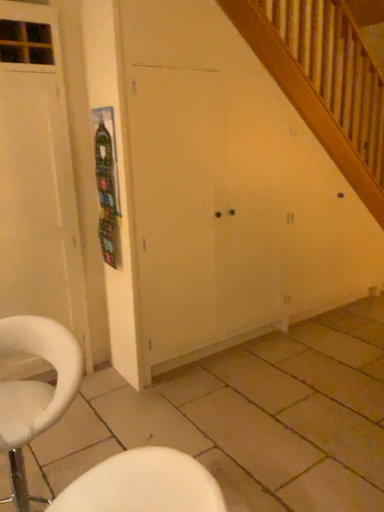
Where is `white fabric chair at lower left`? white fabric chair at lower left is located at coordinates (35, 392).

At what (x,y) coordinates should I click in order to perform the action: click on white matte cabinet at center. Please return your answer as a coordinate pair (x, y). Looking at the image, I should click on (192, 222).

From the image's perspective, is white matte cabinet at center positioned above or below metallic silver poster at upper left?

From the image's perspective, white matte cabinet at center appears below metallic silver poster at upper left.

Does white matte cabinet at center appear on the left side of metallic silver poster at upper left?

No, white matte cabinet at center is not to the left of metallic silver poster at upper left.

In the scene shown: Can metallic silver poster at upper left be found inside white matte cabinet at center?

Definitely not — metallic silver poster at upper left is not inside white matte cabinet at center.

Which of these two, white matte cabinet at center or white fabric chair at lower left, is thinner?

white fabric chair at lower left.

Locate an element on the screen. This screenshot has width=384, height=512. chair below the white matte cabinet at center (from the image's perspective) is located at coordinates (35, 392).

From the picture: Is white matte cabinet at center oriented towards white fabric chair at lower left?

No, white matte cabinet at center is not aimed at white fabric chair at lower left.

From the image's perspective, is white matte cabinet at center located beneath white fabric chair at lower left?

No, from the image's perspective, white matte cabinet at center is not beneath white fabric chair at lower left.

Is point (21, 370) behind point (354, 339)?

That is False.

Does white wood door at left contain beige tile at lower center?

No.

Looking at this image, from the image's perspective, is white wood door at left positioned above or below beige tile at lower center?

Based on their image positions, white wood door at left is located above beige tile at lower center.

From a real-world perspective, is metallic silver poster at upper left located higher than white matte cabinet at center?

Yes.

From the image's perspective, which one is positioned higher, metallic silver poster at upper left or white matte cabinet at center?

metallic silver poster at upper left, from the image's perspective.

Is metallic silver poster at upper left facing towards white matte cabinet at center?

No, metallic silver poster at upper left is not turned towards white matte cabinet at center.

Is there a large distance between metallic silver poster at upper left and white matte cabinet at center?

Actually, metallic silver poster at upper left and white matte cabinet at center are a little close together.

From a real-world perspective, is beige tile at lower center positioned above or below white matte cabinet at center?

Clearly, from a real-world perspective, beige tile at lower center is below white matte cabinet at center.

Looking at the image, does beige tile at lower center seem bigger or smaller compared to white matte cabinet at center?

Considering their sizes, beige tile at lower center takes up less space than white matte cabinet at center.

Consider the image. Which is correct: beige tile at lower center is inside white matte cabinet at center, or outside of it?

beige tile at lower center is outside white matte cabinet at center.

Is beige tile at lower center far from white matte cabinet at center?

No, there isn't a large distance between beige tile at lower center and white matte cabinet at center.

Is white matte cabinet at center further to camera compared to beige tile at lower center?

Yes, it is.

Which is in front, point (206, 322) or point (239, 460)?

The point (239, 460) is closer to the camera.

What's the angular difference between white matte cabinet at center and beige tile at lower center's facing directions?

They differ by 89.5 degrees in their facing directions.

From a real-world perspective, is metallic silver poster at upper left physically located above or below white wood door at left?

From a real-world perspective, metallic silver poster at upper left is physically above white wood door at left.

Who is more distant, metallic silver poster at upper left or white wood door at left?

metallic silver poster at upper left is further from the camera.

Find the location of `bulletin board behind the white wood door at left`. bulletin board behind the white wood door at left is located at coordinates (106, 182).

Where is `bulletin board behind the white matte cabinet at center`? bulletin board behind the white matte cabinet at center is located at coordinates (106, 182).

You are a GUI agent. You are given a task and a screenshot of the screen. Output one action in this format:
    pyautogui.click(x=<x>, y=<y>)
    Task: Click on the chair located underneath the white matte cabinet at center (from a real-world perspective)
    This screenshot has width=384, height=512.
    Given the screenshot: What is the action you would take?
    pyautogui.click(x=35, y=392)

Looking at the image, which one is located further to beige tile at lower center, white matte cabinet at center or white wood door at left?

white wood door at left is further to beige tile at lower center.

From the image, which object appears to be nearer to metallic silver poster at upper left, white wood door at left or white fabric chair at lower left?

white wood door at left is closer to metallic silver poster at upper left.

Looking at the image, which one is located further to white matte cabinet at center, metallic silver poster at upper left or beige tile at lower center?

The object further to white matte cabinet at center is beige tile at lower center.

Which object lies further to the anchor point metallic silver poster at upper left, beige tile at lower center or white matte cabinet at center?

beige tile at lower center is further to metallic silver poster at upper left.

Considering their positions, is white matte cabinet at center positioned closer to white wood door at left than beige tile at lower center?

Among the two, white matte cabinet at center is located nearer to white wood door at left.

Which object lies further to the anchor point beige tile at lower center, white matte cabinet at center or white fabric chair at lower left?

The object further to beige tile at lower center is white fabric chair at lower left.

From the image, which object appears to be farther from white fabric chair at lower left, white wood door at left or white matte cabinet at center?

white matte cabinet at center is positioned further to the anchor white fabric chair at lower left.

From the image, which object appears to be nearer to white fabric chair at lower left, metallic silver poster at upper left or white matte cabinet at center?

The object closer to white fabric chair at lower left is metallic silver poster at upper left.

Locate an element on the screen. Image resolution: width=384 pixels, height=512 pixels. screen door between beige tile at lower center and metallic silver poster at upper left from front to back is located at coordinates (192, 222).

Locate an element on the screen. This screenshot has height=512, width=384. chair between white wood door at left and beige tile at lower center from left to right is located at coordinates tap(35, 392).

Identify the location of bulletin board situated between white wood door at left and white matte cabinet at center from left to right. (106, 182).

The image size is (384, 512). What are the coordinates of `bulletin board between white fabric chair at lower left and beige tile at lower center from left to right` in the screenshot? It's located at (106, 182).